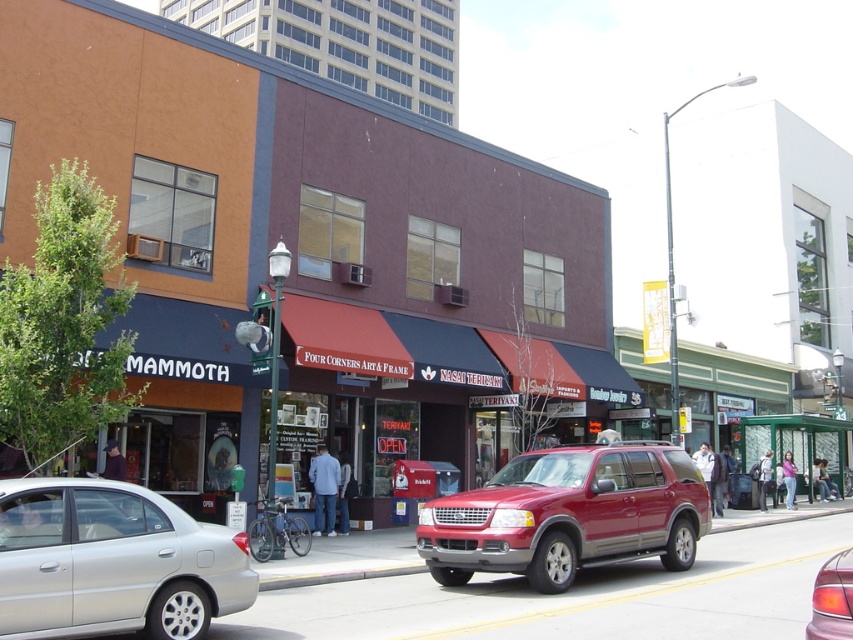
Question: Which of the following is the closest to the observer?

Choices:
 (A) (100, 628)
 (B) (839, 628)
 (C) (654, 518)

Answer: (B)

Question: Which point is farther from the camera taking this photo?

Choices:
 (A) (548, 531)
 (B) (817, 576)
 (C) (10, 556)

Answer: (A)

Question: From the image, what is the correct spatial relationship of silver metallic sedan at lower left in relation to shiny red suv at center?

Choices:
 (A) above
 (B) below

Answer: (A)

Question: Can you confirm if silver metallic sedan at lower left is positioned to the right of shiny red suv at center?

Choices:
 (A) yes
 (B) no

Answer: (B)

Question: Which point appears farthest from the camera in this image?

Choices:
 (A) (131, 484)
 (B) (820, 579)

Answer: (A)

Question: Can you confirm if silver metallic sedan at lower left is bigger than shiny red suv at center?

Choices:
 (A) yes
 (B) no

Answer: (B)